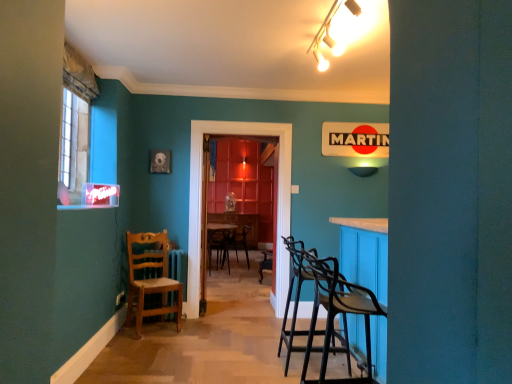
Question: Could white glossy track light at upper center be considered to be inside wooden picture frame at upper left?

Choices:
 (A) yes
 (B) no

Answer: (B)

Question: Is wooden picture frame at upper left far away from white glossy track light at upper center?

Choices:
 (A) yes
 (B) no

Answer: (A)

Question: Is wooden picture frame at upper left further to the viewer compared to white glossy track light at upper center?

Choices:
 (A) yes
 (B) no

Answer: (A)

Question: Can you confirm if wooden picture frame at upper left is taller than white glossy track light at upper center?

Choices:
 (A) yes
 (B) no

Answer: (A)

Question: From the image's perspective, is wooden picture frame at upper left located beneath white glossy track light at upper center?

Choices:
 (A) yes
 (B) no

Answer: (A)

Question: Is wooden picture frame at upper left wider or thinner than matte plastic power outlet at lower left?

Choices:
 (A) thin
 (B) wide

Answer: (B)

Question: Considering the positions of wooden picture frame at upper left and matte plastic power outlet at lower left in the image, is wooden picture frame at upper left bigger or smaller than matte plastic power outlet at lower left?

Choices:
 (A) big
 (B) small

Answer: (A)

Question: Is wooden picture frame at upper left in front of or behind matte plastic power outlet at lower left in the image?

Choices:
 (A) front
 (B) behind

Answer: (B)

Question: From the image's perspective, is wooden picture frame at upper left above or below matte plastic power outlet at lower left?

Choices:
 (A) above
 (B) below

Answer: (A)

Question: Is wooden picture frame at upper left in front of or behind translucent wooden door at center in the image?

Choices:
 (A) behind
 (B) front

Answer: (B)

Question: Would you say wooden picture frame at upper left is to the left or to the right of translucent wooden door at center in the picture?

Choices:
 (A) left
 (B) right

Answer: (A)

Question: Which is correct: wooden picture frame at upper left is inside translucent wooden door at center, or outside of it?

Choices:
 (A) outside
 (B) inside

Answer: (A)

Question: Is point (157, 155) closer or farther from the camera than point (279, 218)?

Choices:
 (A) closer
 (B) farther

Answer: (A)

Question: From the image's perspective, is wooden chair at left located above or below translucent wooden door at center?

Choices:
 (A) above
 (B) below

Answer: (B)

Question: Based on their sizes in the image, would you say wooden chair at left is bigger or smaller than translucent wooden door at center?

Choices:
 (A) small
 (B) big

Answer: (A)